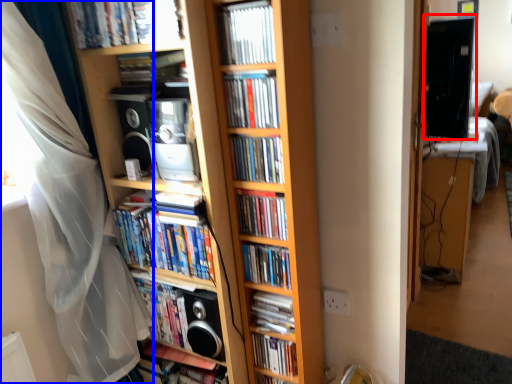
Question: Which object is further to the camera taking this photo, computer monitor (highlighted by a red box) or curtain (highlighted by a blue box)?

Choices:
 (A) computer monitor
 (B) curtain

Answer: (A)